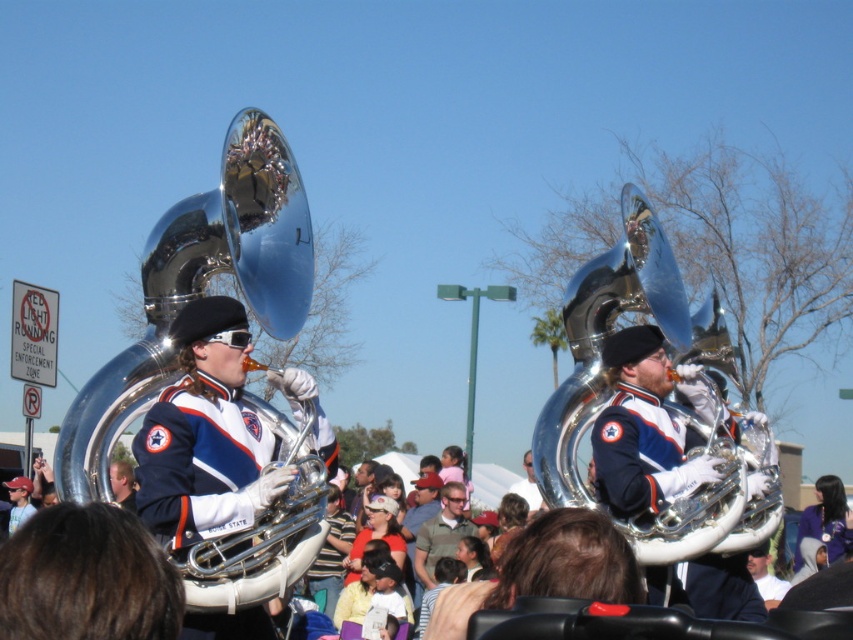
You are a photographer trying to capture a photo of the polished silver tuba at center and the matte blue uniform at center. The camera you are using has a maximum focus range of 30 meters. Can you take a clear photo of both objects without moving your position?

The polished silver tuba at center is 33.79 meters away from the matte blue uniform at center. Since the camera can only focus up to 30 meters, the distance between them exceeds the camera range. Therefore, you cannot take a clear photo of both objects without moving.

Based on the photo, you are a photographer positioned at the center of the scene. You want to capture a closeup of the polished silver tuba at left without including the musician playing it. Given the tuba is at coordinate point 0.450, 0.234, can you frame your shot to exclude the musician?

The polished silver tuba at left is located at point (199, 288). Since the musician is part of the tuba object, it is not possible to exclude them from the frame while capturing the tuba.